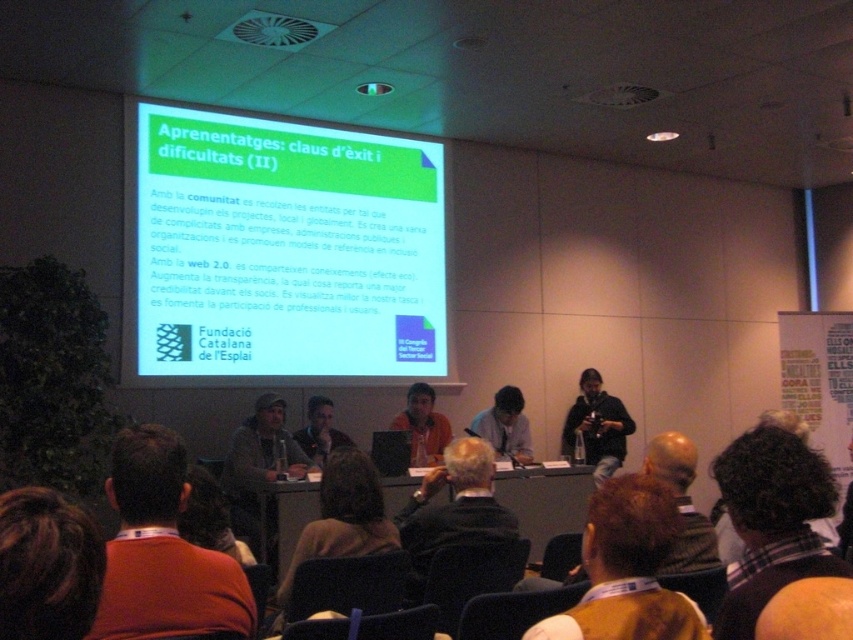
Question: From the image, what is the correct spatial relationship of brown hair at lower left in relation to matte black jacket at center?

Choices:
 (A) above
 (B) below

Answer: (A)

Question: Based on their relative distances, which object is farther from the matte black jacket at center?

Choices:
 (A) brown hair at lower left
 (B) dark gray jacket at lower right

Answer: (A)

Question: Does smooth wooden table at center appear under dark gray jacket at lower right?

Choices:
 (A) no
 (B) yes

Answer: (B)

Question: Can you confirm if dark curly hair at upper right is positioned to the left of brown hair at lower center?

Choices:
 (A) yes
 (B) no

Answer: (B)

Question: Which point is farther to the camera?

Choices:
 (A) (288, 490)
 (B) (112, 564)
 (C) (625, 432)
 (D) (83, 616)

Answer: (C)

Question: Which object is the farthest from the smooth wooden table at center?

Choices:
 (A) green matte projector screen at upper center
 (B) light brown leather jacket at center
 (C) matte black jacket at center

Answer: (A)